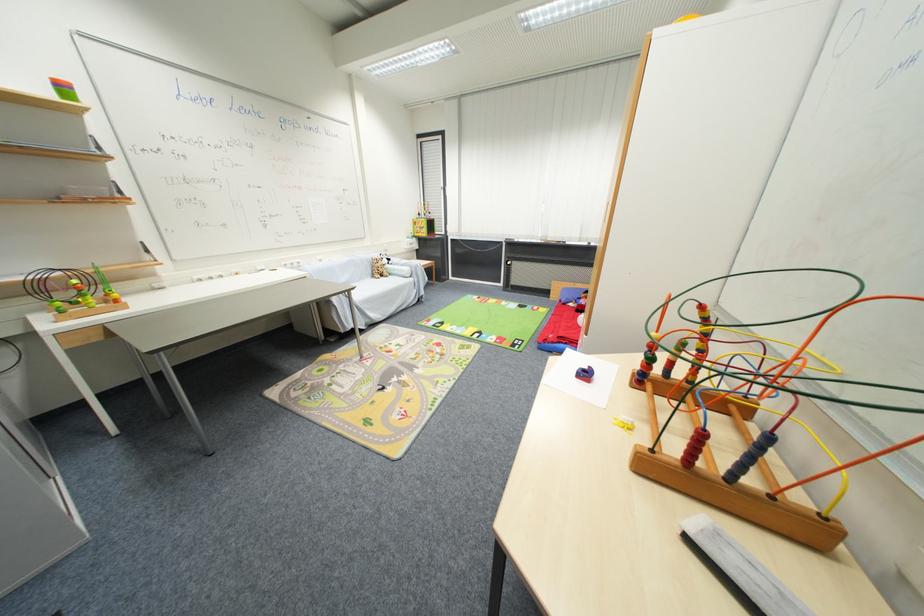
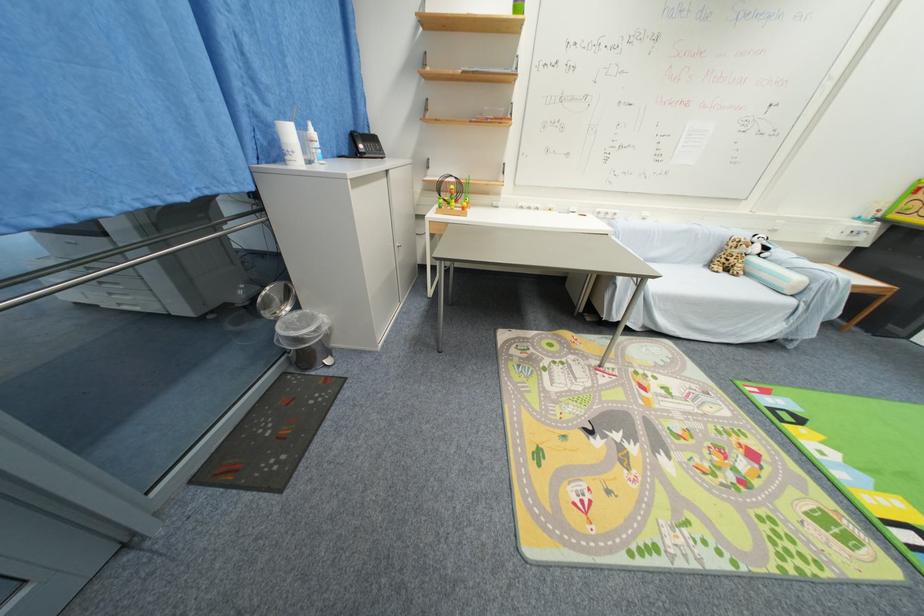
The point at [391,262] is marked in the first image. Where is the corresponding point in the second image?

(761, 251)